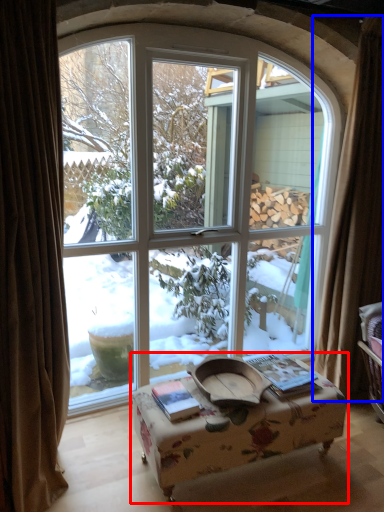
Question: Which object appears closest to the camera in this image, table (highlighted by a red box) or curtain (highlighted by a blue box)?

Choices:
 (A) table
 (B) curtain

Answer: (A)